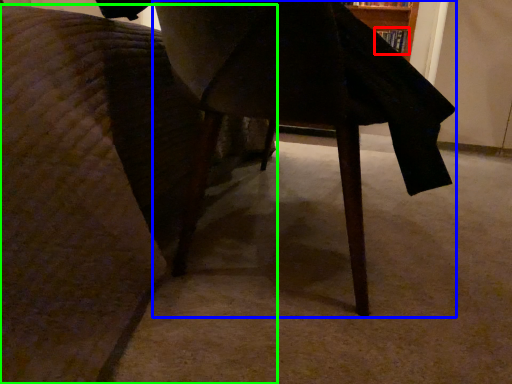
Question: Based on their relative distances, which object is farther from book (highlighted by a red box)? Choose from table (highlighted by a blue box) and furniture (highlighted by a green box).

Choices:
 (A) table
 (B) furniture

Answer: (B)